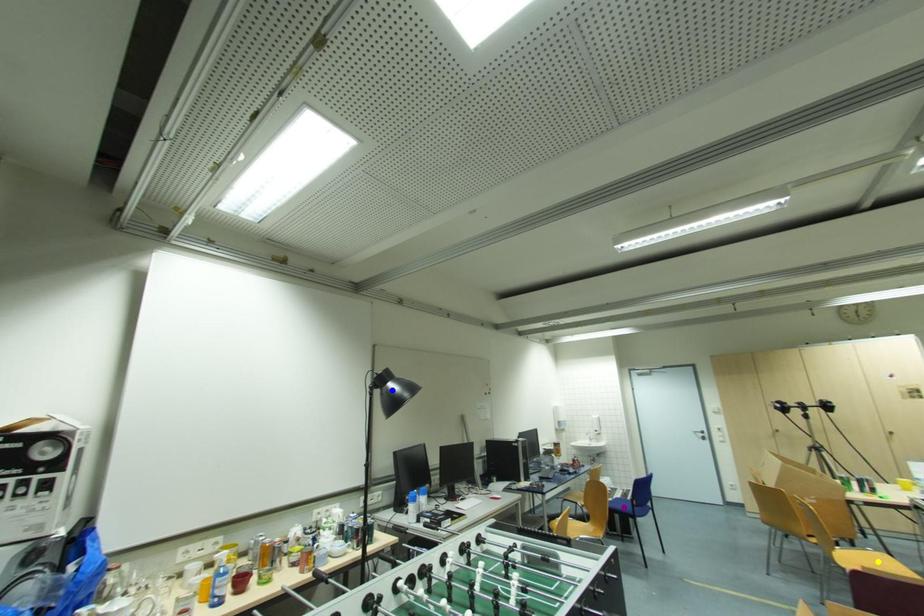
From the picture: Order these from nearest to farthest:
1. purple point
2. blue point
3. yellow point

yellow point, blue point, purple point